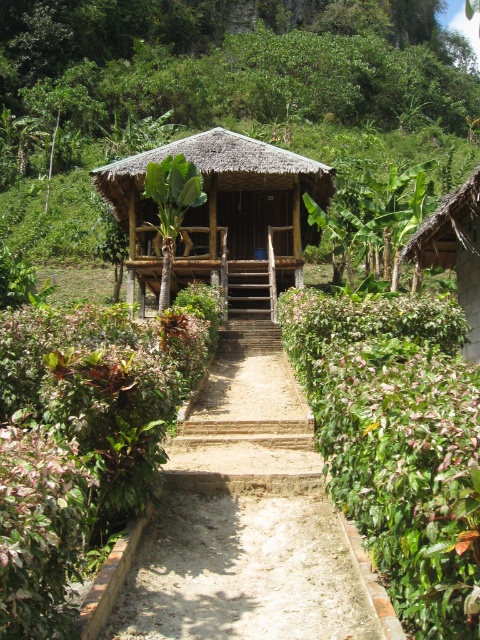
You are standing at the entrance of the rustic wooden hut and want to walk towards the point that is closer to you. Which point should you head towards, point (113, 593) or point (419, 241)?

Point (113, 593) is closer to the viewer than point (419, 241), so you should head towards point (113, 593).

You are planning to build a new structure between the thatched bamboo hut at center and the thatched roof hut at right. Considering their heights, which one should you place your new structure closer to so it doesn

The thatched roof hut at right is shorter than the thatched bamboo hut at center, so placing the new structure closer to the thatched roof hut at right would ensure better visibility and avoid blocking the taller structure.

You are standing at the entrance of the thatched bamboo hut at center and want to walk to the thatched roof hut at right. Which direction should you go?

You should go to the right because the thatched bamboo hut at center is to the left of the thatched roof hut at right.